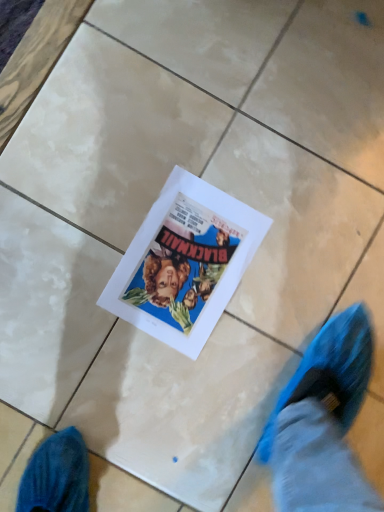
Find the location of a particular element. The image size is (384, 512). free location in front of white paper at center is located at coordinates (107, 364).